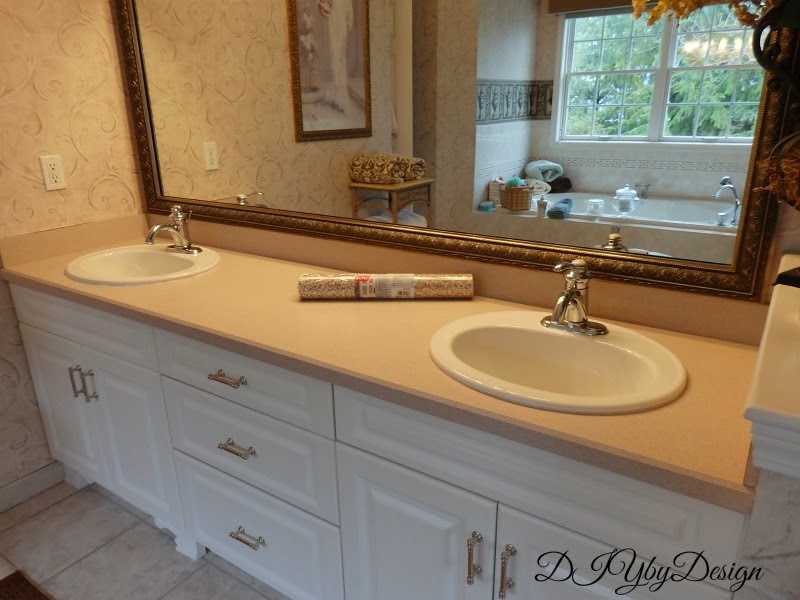
Find the location of `pulls`. pulls is located at coordinates (222, 382), (230, 448), (246, 539), (81, 388), (74, 384), (470, 554), (500, 575).